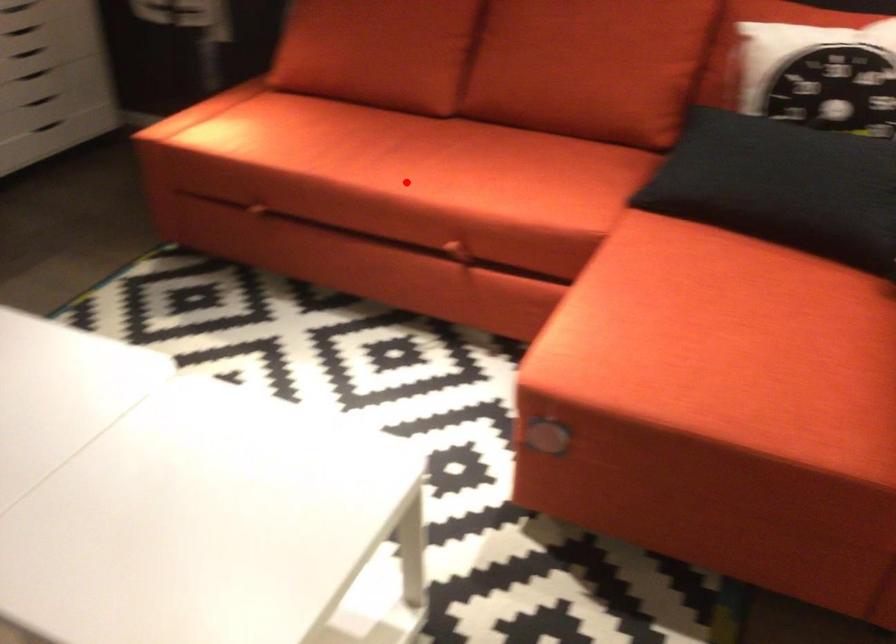
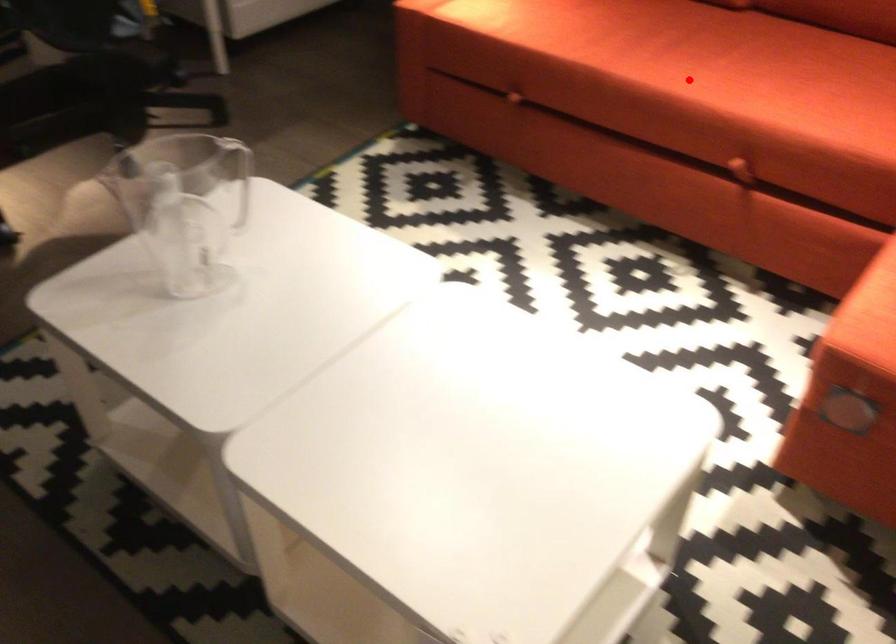
I am providing you with two images of the same scene from different viewpoints. A red point is marked on the first image and another point is marked on the second image. Are the points marked in image1 and image2 representing the same 3D position?

Yes